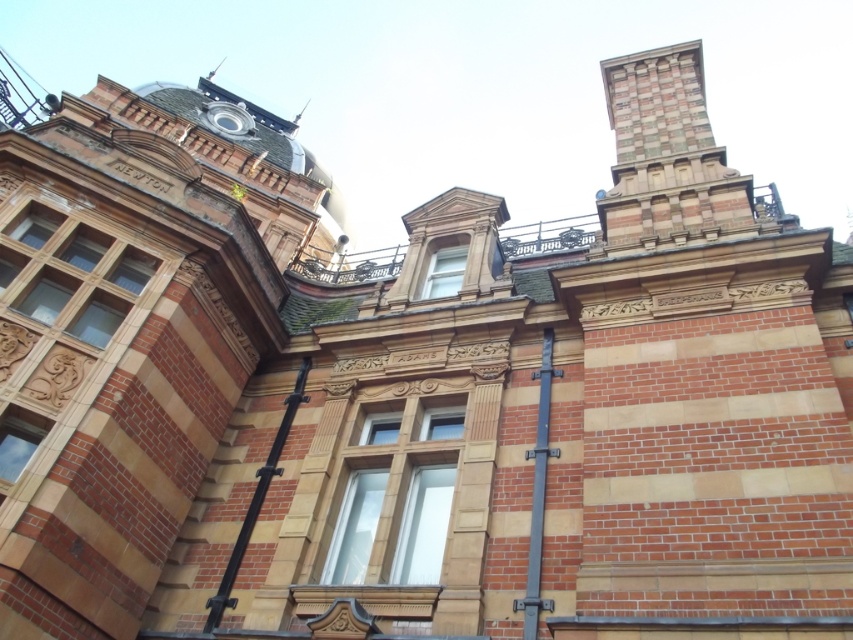
You are an architect planning to install a new decorative element between the brown wooden window at upper left and the clear glass window at upper center. The element requires a minimum of 25 meters of space between the two windows. Based on the scene, will there be enough space for this installation?

The brown wooden window at upper left and clear glass window at upper center are 26.05 meters apart, which exceeds the required 25 meters. Therefore, there is sufficient space for the decorative element between them.

Based on the photo, you are standing in front of the grand historic building and notice two windows. The first is the brown wooden window at upper left, and the second is the clear glass window at upper center. Which window is positioned to the right of the other?

Answer: The clear glass window at upper center is to the right of the brown wooden window at upper left.